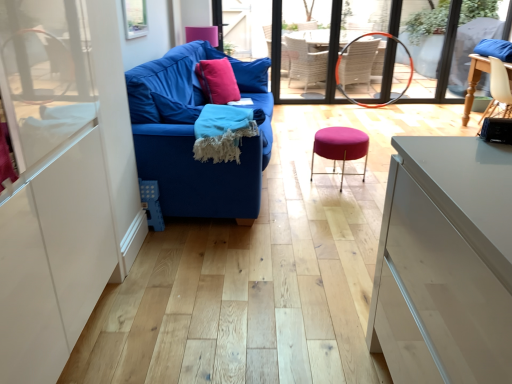
Find the location of a particular element. This screenshot has width=512, height=384. vacant space situated above purple fabric stool at center (from a real-world perspective) is located at coordinates (335, 131).